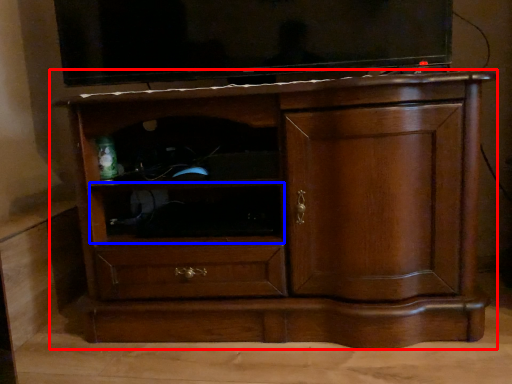
Question: Which of the following is the farthest to the observer, chest of drawers (highlighted by a red box) or shelf (highlighted by a blue box)?

Choices:
 (A) chest of drawers
 (B) shelf

Answer: (B)